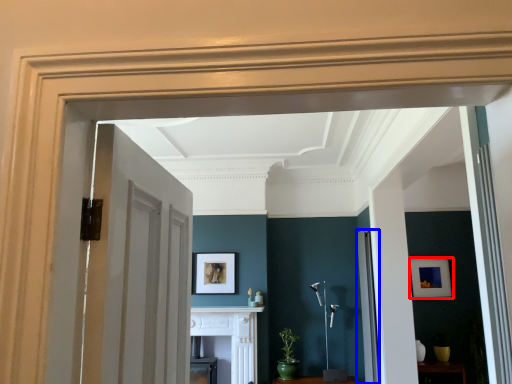
Question: Among these objects, which one is farthest to the camera, picture frame (highlighted by a red box) or door (highlighted by a blue box)?

Choices:
 (A) picture frame
 (B) door

Answer: (A)